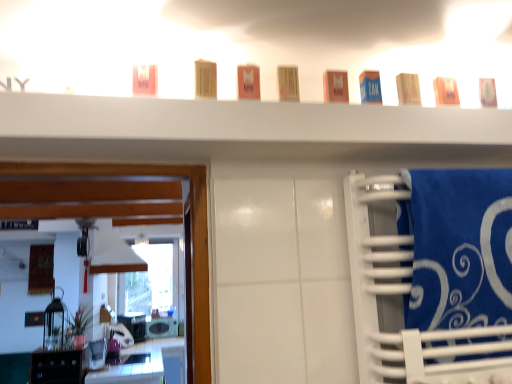
Question: Considering the relative sizes of matte pink soap at upper left, arranged as the 1th toiletry when viewed from the left, and orange matte box at center, the third toiletry when ordered from left to right, in the image provided, is matte pink soap at upper left, arranged as the 1th toiletry when viewed from the left, taller than orange matte box at center, the third toiletry when ordered from left to right,?

Choices:
 (A) no
 (B) yes

Answer: (A)

Question: Does matte pink soap at upper left, arranged as the 1th toiletry when viewed from the left, lie in front of orange matte box at center, the third toiletry when ordered from left to right?

Choices:
 (A) yes
 (B) no

Answer: (A)

Question: Is there a large distance between matte pink soap at upper left, arranged as the 1th toiletry when viewed from the left, and orange matte box at center, which is the 6th toiletry in right-to-left order?

Choices:
 (A) yes
 (B) no

Answer: (B)

Question: From a real-world perspective, is matte pink soap at upper left, acting as the eighth toiletry starting from the right, physically above orange matte box at center, the third toiletry when ordered from left to right?

Choices:
 (A) no
 (B) yes

Answer: (A)

Question: Is matte pink soap at upper left, acting as the eighth toiletry starting from the right, not inside orange matte box at center, which is the 6th toiletry in right-to-left order?

Choices:
 (A) no
 (B) yes

Answer: (B)

Question: Can you confirm if matte pink soap at upper left, acting as the eighth toiletry starting from the right, is positioned to the right of orange matte box at center, the third toiletry when ordered from left to right?

Choices:
 (A) no
 (B) yes

Answer: (A)

Question: From the image's perspective, is metallic silver toaster at lower left, the second appliance when ordered from back to front, on top of orange matte box at center, the third toiletry when ordered from left to right?

Choices:
 (A) no
 (B) yes

Answer: (A)

Question: Is metallic silver toaster at lower left, the second appliance when ordered from back to front, positioned far away from orange matte box at center, the third toiletry when ordered from left to right?

Choices:
 (A) no
 (B) yes

Answer: (B)

Question: Is metallic silver toaster at lower left, the second appliance when ordered from back to front, thinner than orange matte box at center, the third toiletry when ordered from left to right?

Choices:
 (A) yes
 (B) no

Answer: (B)

Question: Is metallic silver toaster at lower left, which ranks as the 1th appliance in top-to-bottom order, looking in the opposite direction of orange matte box at center, the third toiletry when ordered from left to right?

Choices:
 (A) no
 (B) yes

Answer: (A)

Question: Can you confirm if metallic silver toaster at lower left, which ranks as the 1th appliance in top-to-bottom order, is bigger than orange matte box at center, the third toiletry when ordered from left to right?

Choices:
 (A) yes
 (B) no

Answer: (A)

Question: Is metallic silver toaster at lower left, which appears as the first appliance when viewed from the front, aimed at orange matte box at center, the third toiletry when ordered from left to right?

Choices:
 (A) no
 (B) yes

Answer: (A)

Question: From a real-world perspective, is white glossy microwave at lower left, which appears as the first appliance when viewed from the back, positioned over matte plastic container at center, the 4th toiletry positioned from the left, based on gravity?

Choices:
 (A) no
 (B) yes

Answer: (A)